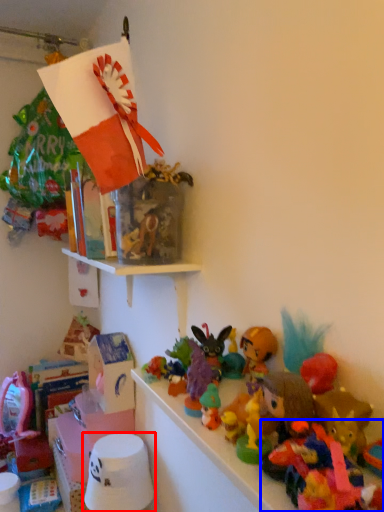
Question: Among these objects, which one is nearest to the camera, toy (highlighted by a red box) or toy (highlighted by a blue box)?

Choices:
 (A) toy
 (B) toy

Answer: (B)